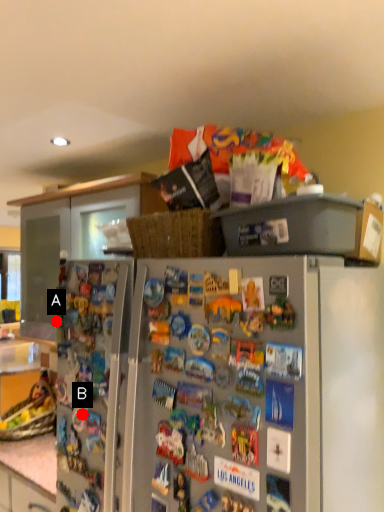
Question: Two points are circled on the image, labeled by A and B beside each circle. Which point appears farthest from the camera in this image?

Choices:
 (A) A is further
 (B) B is further

Answer: (A)